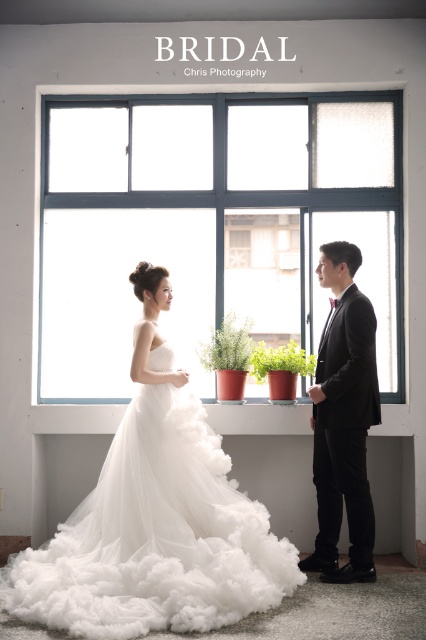
You are a photographer adjusting your camera settings. You notice two points in the image at coordinates point [304,202] and point [207,444]. Which point is closer to the camera?

Point [304,202] is further to the camera than point [207,444], so the point closer to the camera is point [207,444].

You are a photographer standing in front of the bridal couple. You want to take a photo that includes both the white tulle dress at center and the black satin suit at right. Based on their positions, which one is closer to you?

The white tulle dress at center is closer to you because it is in front of the black satin suit at right.